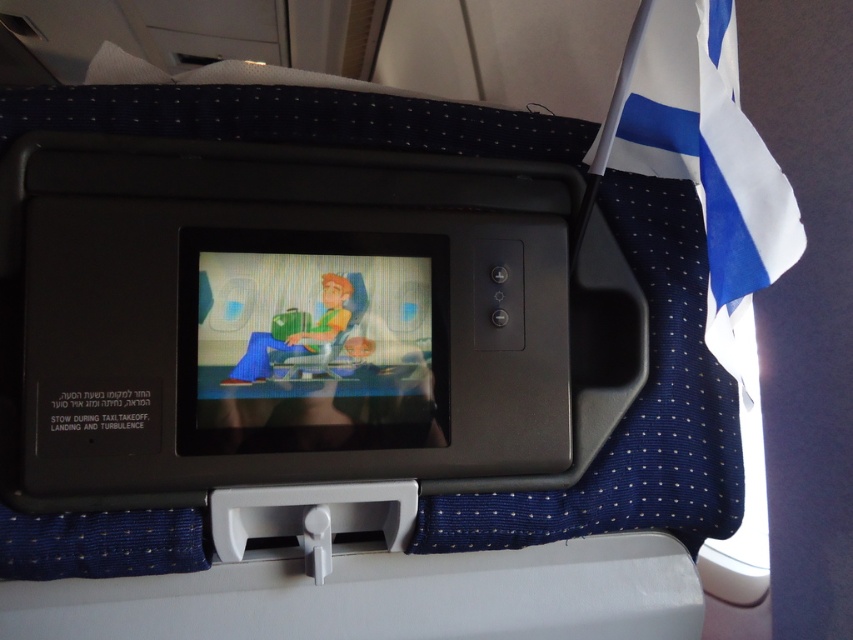
Question: From the image, what is the correct spatial relationship of matte plastic screen at center in relation to blue fabric flag at upper right?

Choices:
 (A) below
 (B) above

Answer: (A)

Question: Does matte plastic screen at center appear over blue fabric flag at upper right?

Choices:
 (A) yes
 (B) no

Answer: (B)

Question: Is matte plastic screen at center to the right of blue fabric flag at upper right from the viewer's perspective?

Choices:
 (A) yes
 (B) no

Answer: (B)

Question: Which point appears closest to the camera in this image?

Choices:
 (A) (763, 204)
 (B) (357, 372)

Answer: (A)